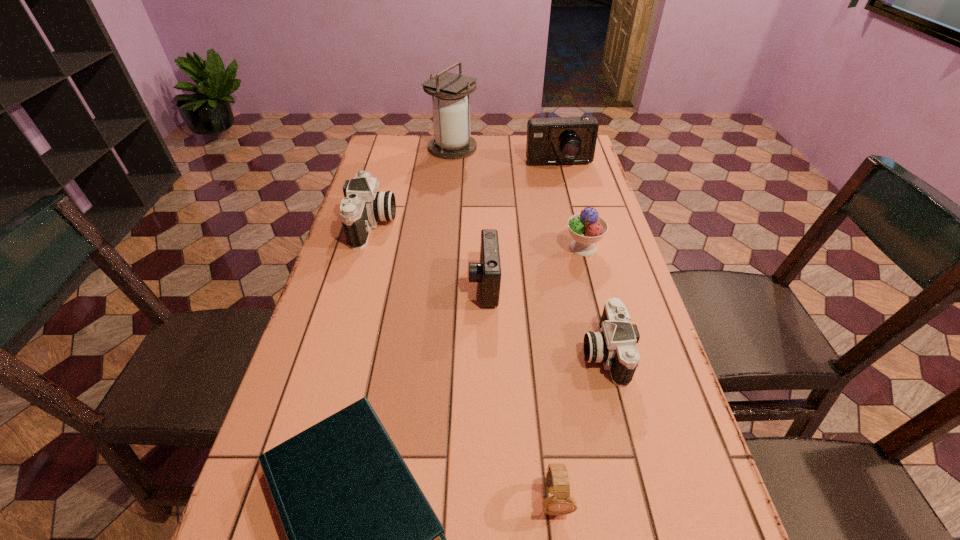
Locate an element on the screen. This screenshot has height=540, width=960. free location that satisfies the following two spatial constraints: 1. on the front-facing side of the nearer blue camera; 2. on the back side of the nearest camera is located at coordinates pyautogui.click(x=485, y=352).